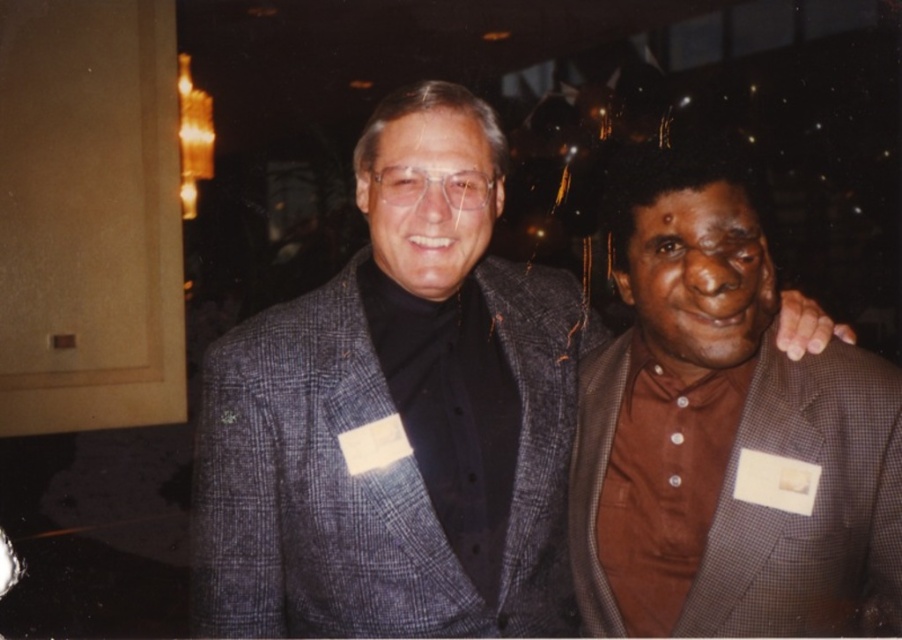
Can you confirm if plaid wool blazer at center is taller than brown matte shirt at right?

Yes.

Does point (367, 179) come behind point (618, 259)?

Yes.

Between point (474, 324) and point (620, 216), which one is positioned behind?

Positioned behind is point (474, 324).

The height and width of the screenshot is (640, 902). I want to click on plaid wool blazer at center, so click(397, 416).